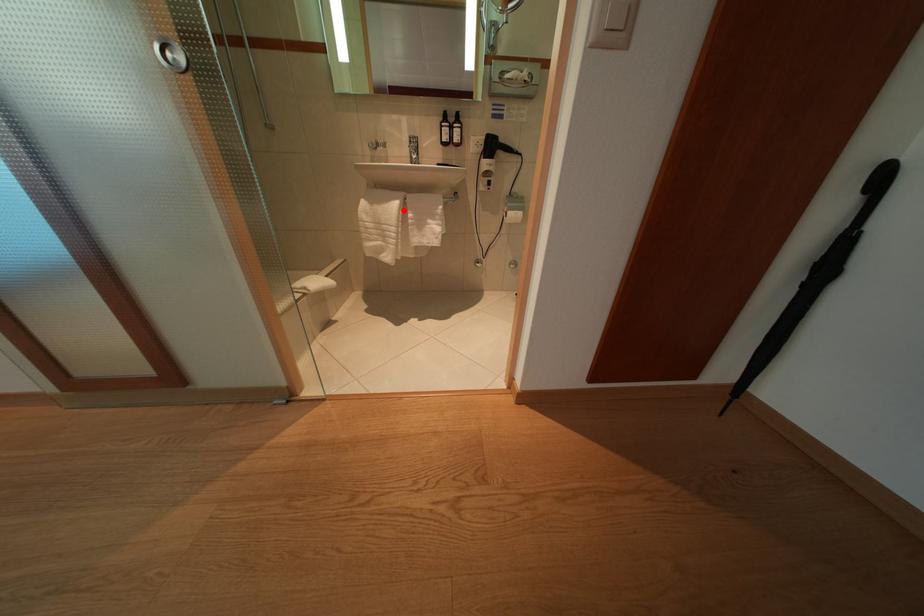
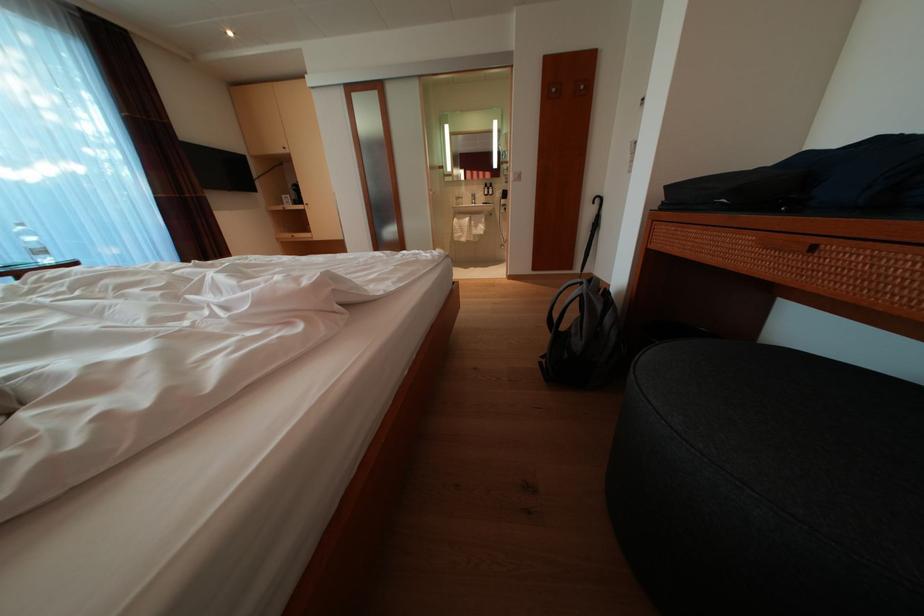
Locate, in the second image, the point that corresponds to the highlighted location in the first image.

(476, 225)